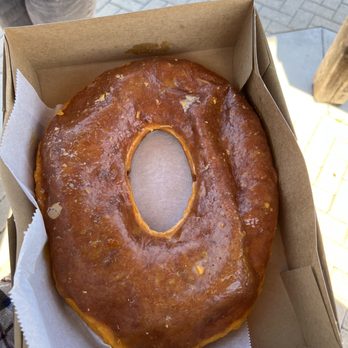
This screenshot has height=348, width=348. Identify the location of wood post. (333, 82).